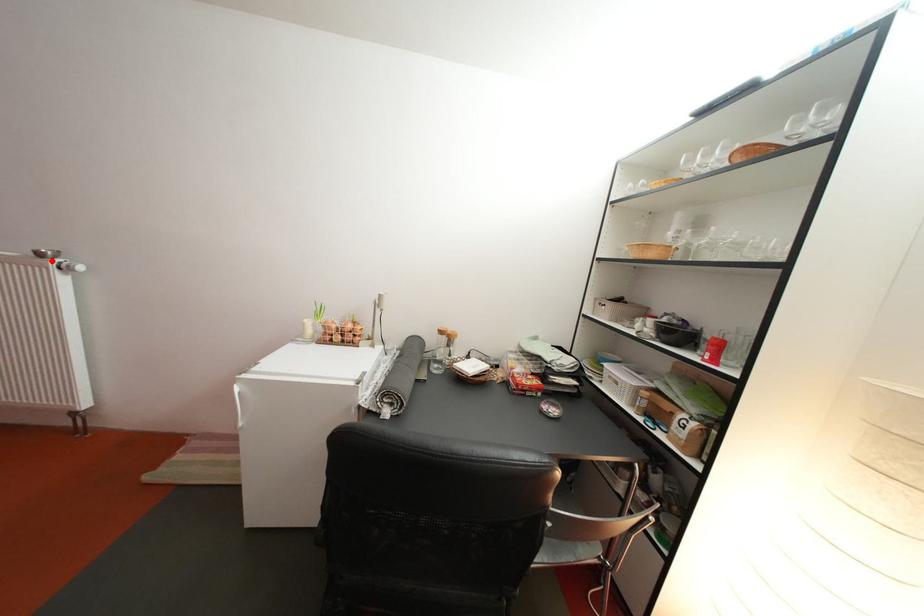
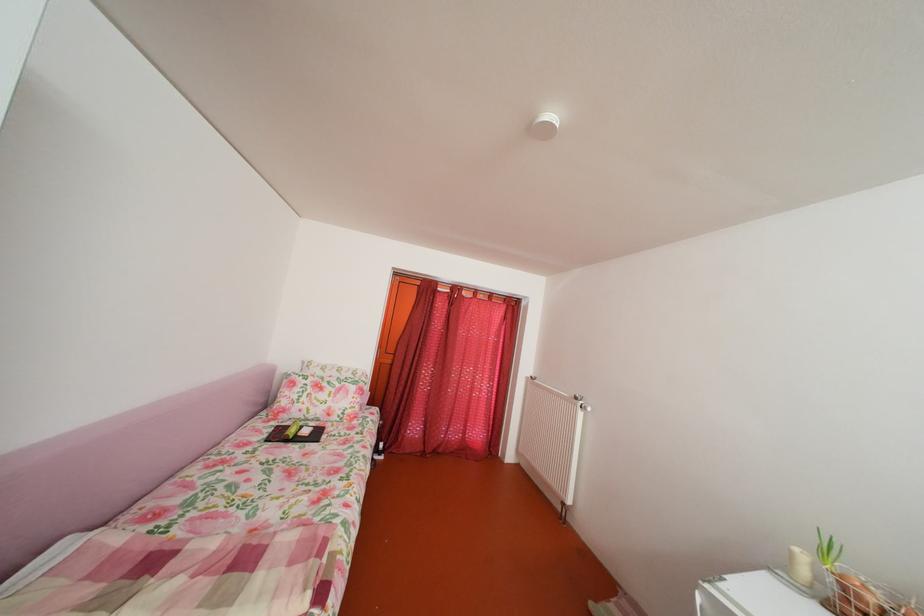
Where in the second image is the point corresponding to the highlighted location from the first image?

(588, 405)